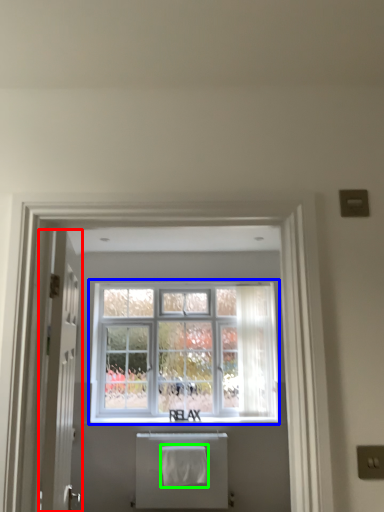
Question: Which is farther away from door (highlighted by a red box)? window (highlighted by a blue box) or bath towel (highlighted by a green box)?

Choices:
 (A) window
 (B) bath towel

Answer: (A)